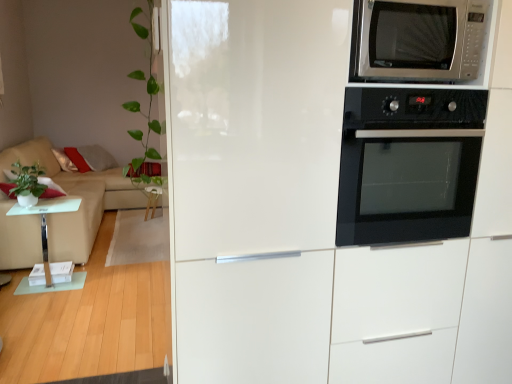
Question: From the image's perspective, is green leafy plant at left, which is counted as the 2th plant, starting from the back, on top of green matte plant at left, which is the 2th plant from right to left?

Choices:
 (A) yes
 (B) no

Answer: (A)

Question: Is green matte plant at left, which is the 2th plant from right to left, completely or partially inside green leafy plant at left, which appears as the second plant when viewed from the left?

Choices:
 (A) yes
 (B) no

Answer: (B)

Question: Are green leafy plant at left, which ranks as the first plant in front-to-back order, and green matte plant at left, which appears as the second plant when viewed from the front, far apart?

Choices:
 (A) no
 (B) yes

Answer: (B)

Question: Considering the relative sizes of green leafy plant at left, which ranks as the first plant in front-to-back order, and green matte plant at left, which is the 2th plant from right to left, in the image provided, is green leafy plant at left, which ranks as the first plant in front-to-back order, bigger than green matte plant at left, which is the 2th plant from right to left,?

Choices:
 (A) no
 (B) yes

Answer: (B)

Question: From the image's perspective, is green leafy plant at left, which is counted as the 2th plant, starting from the back, below green matte plant at left, the first plant when ordered from left to right?

Choices:
 (A) no
 (B) yes

Answer: (A)

Question: Considering the positions of transparent glass table at left and green leafy plant at left, which is counted as the 2th plant, starting from the back, in the image, is transparent glass table at left bigger or smaller than green leafy plant at left, which is counted as the 2th plant, starting from the back,?

Choices:
 (A) big
 (B) small

Answer: (A)

Question: Is transparent glass table at left spatially inside green leafy plant at left, which ranks as the first plant in front-to-back order, or outside of it?

Choices:
 (A) outside
 (B) inside

Answer: (A)

Question: Considering the positions of point (69, 198) and point (138, 139), is point (69, 198) closer or farther from the camera than point (138, 139)?

Choices:
 (A) closer
 (B) farther

Answer: (B)

Question: From a real-world perspective, is transparent glass table at left positioned above or below green leafy plant at left, which is counted as the 2th plant, starting from the back?

Choices:
 (A) below
 (B) above

Answer: (A)

Question: Considering their positions, is beige fabric couch at left located in front of or behind green leafy plant at left, which is counted as the 2th plant, starting from the back?

Choices:
 (A) behind
 (B) front

Answer: (A)

Question: In the image, is beige fabric couch at left on the left side or the right side of green leafy plant at left, which is counted as the 2th plant, starting from the back?

Choices:
 (A) left
 (B) right

Answer: (A)

Question: From a real-world perspective, is beige fabric couch at left positioned above or below green leafy plant at left, which ranks as the 1th plant in right-to-left order?

Choices:
 (A) above
 (B) below

Answer: (B)

Question: From the image's perspective, is beige fabric couch at left located above or below green leafy plant at left, which ranks as the 1th plant in right-to-left order?

Choices:
 (A) below
 (B) above

Answer: (A)

Question: Does point (254, 165) appear closer or farther from the camera than point (122, 168)?

Choices:
 (A) closer
 (B) farther

Answer: (A)

Question: From a real-world perspective, is white glossy fridge at upper right above or below green leafy plant at left, which ranks as the first plant in front-to-back order?

Choices:
 (A) below
 (B) above

Answer: (A)